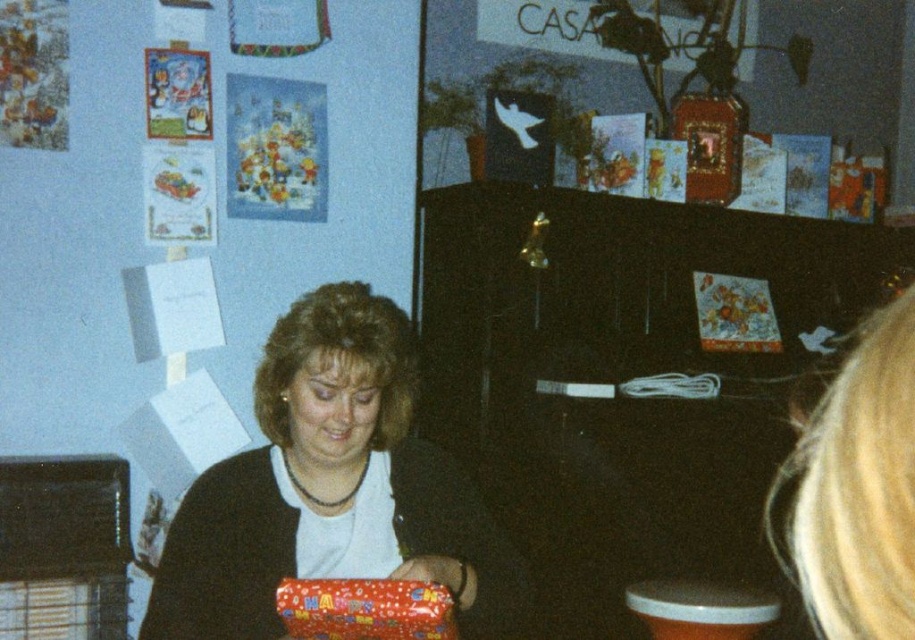
From the picture: You are helping to organize a gift wrapping station. You have two pieces of shiny red wrapping paper at center and shiny red wrapping paper at lower center. Which one is taller?

The shiny red wrapping paper at center is taller than the shiny red wrapping paper at lower center.

You are a delivery person standing at the entrance of the room. You need to place a package on the shiny red wrapping paper at center. Can you reach it from where you are standing?

The shiny red wrapping paper at center is 4.39 feet away from camera, so yes, the delivery person can reach it since it is within a reasonable distance.

You are a guest at a party and see the shiny red wrapping paper at center and the shiny red wrapping paper at lower center. Which one is positioned to the left?

The shiny red wrapping paper at center is positioned to the left of the shiny red wrapping paper at lower center.